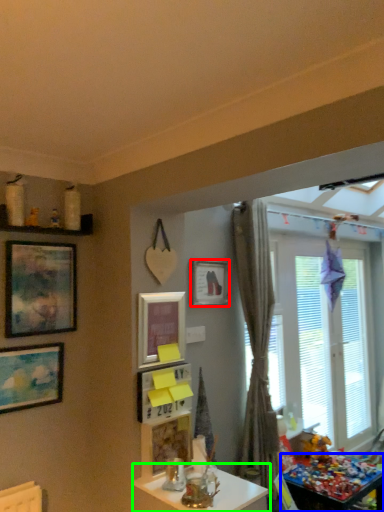
Question: Which object is the farthest from picture frame (highlighted by a red box)? Choose among these: table (highlighted by a blue box) or table (highlighted by a green box).

Choices:
 (A) table
 (B) table

Answer: (A)